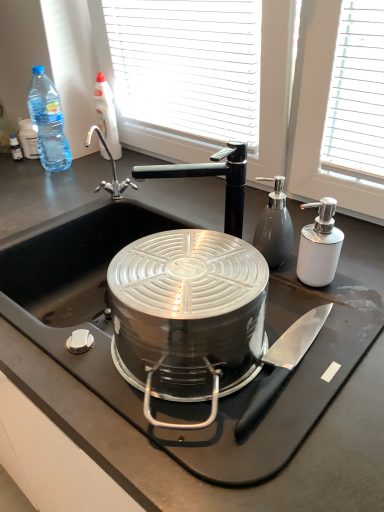
What are the coordinates of `free location to the right of polished stainless steel knife at lower center` in the screenshot? It's located at (349, 341).